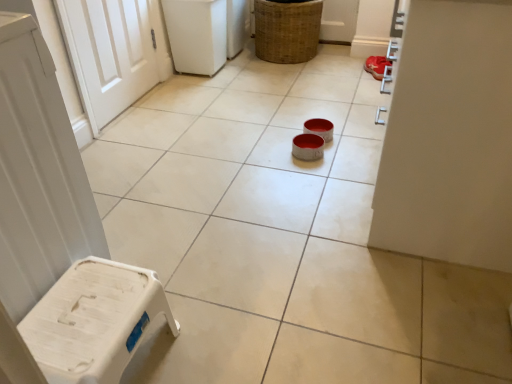
Locate an element on the screen. free space above white plastic stool at lower left (from a real-world perspective) is located at coordinates (86, 308).